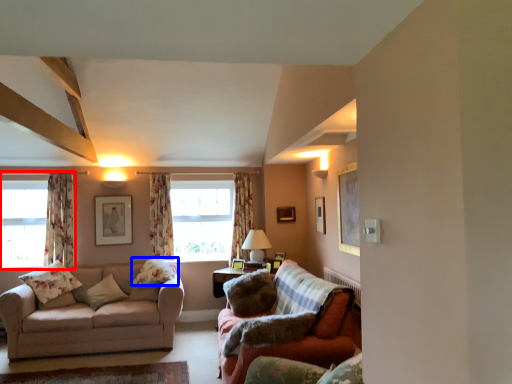
Question: Which object is closer to the camera taking this photo, window (highlighted by a red box) or pillow (highlighted by a blue box)?

Choices:
 (A) window
 (B) pillow

Answer: (B)